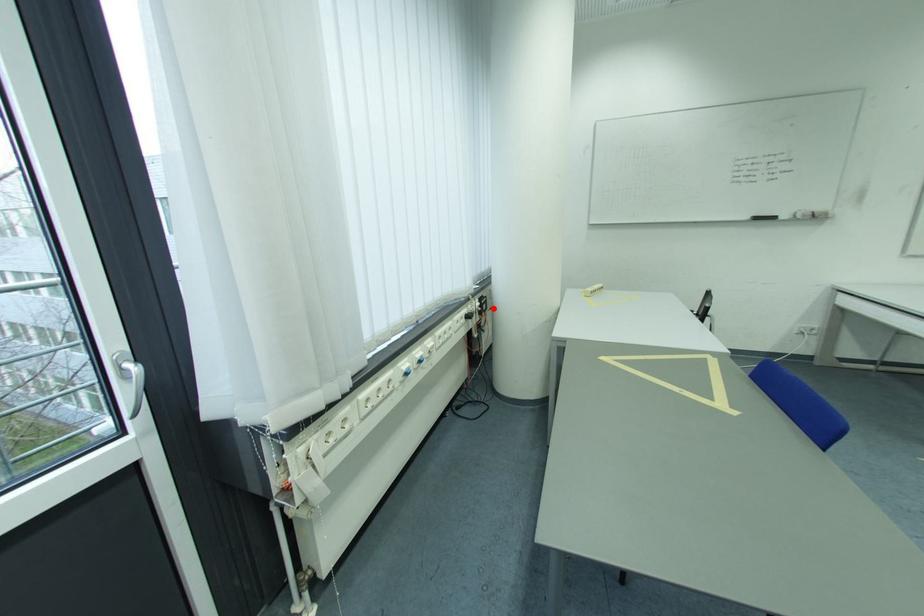
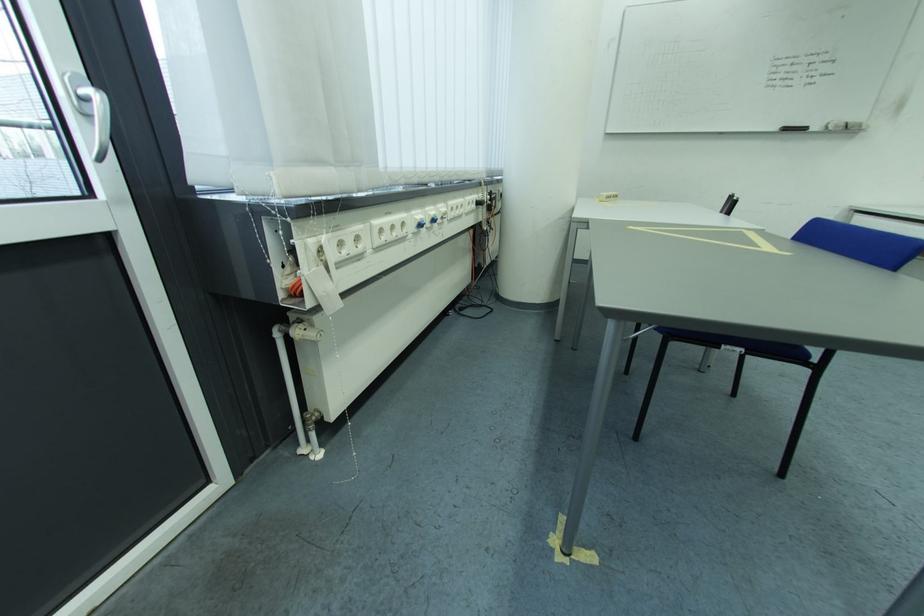
Where in the second image is the point corresponding to the highlighted location from the first image?

(503, 205)